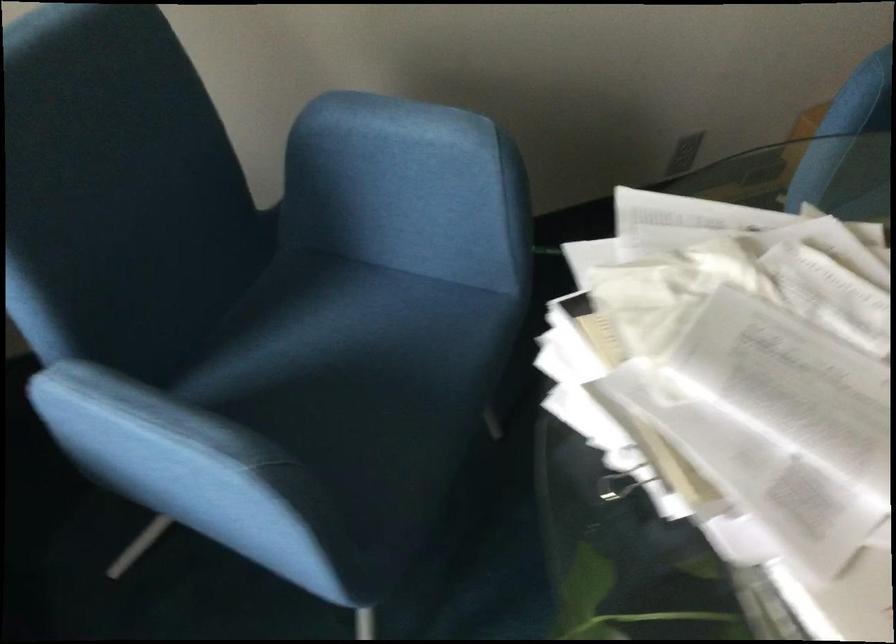
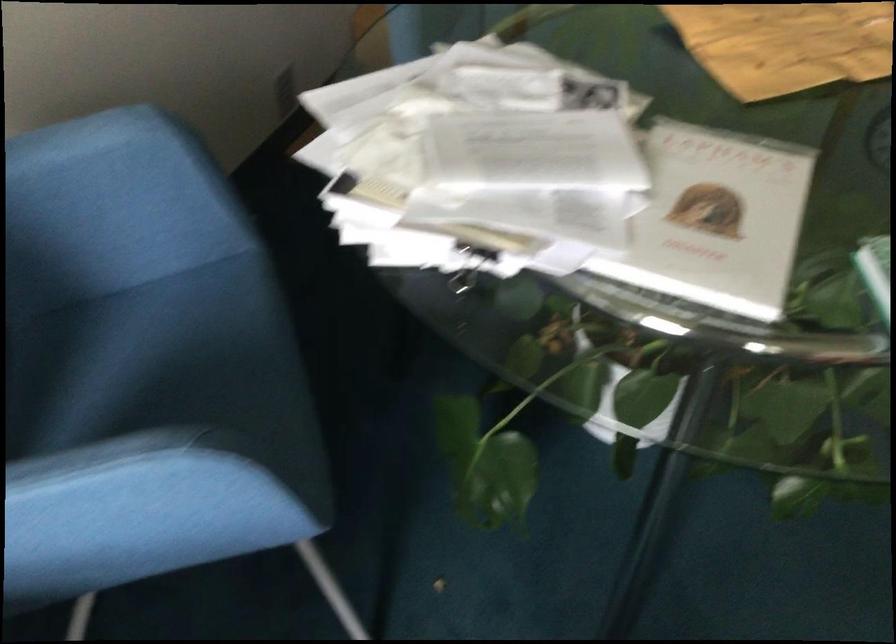
Find the pixel in the second image that matches point (362, 343) in the first image.

(158, 357)